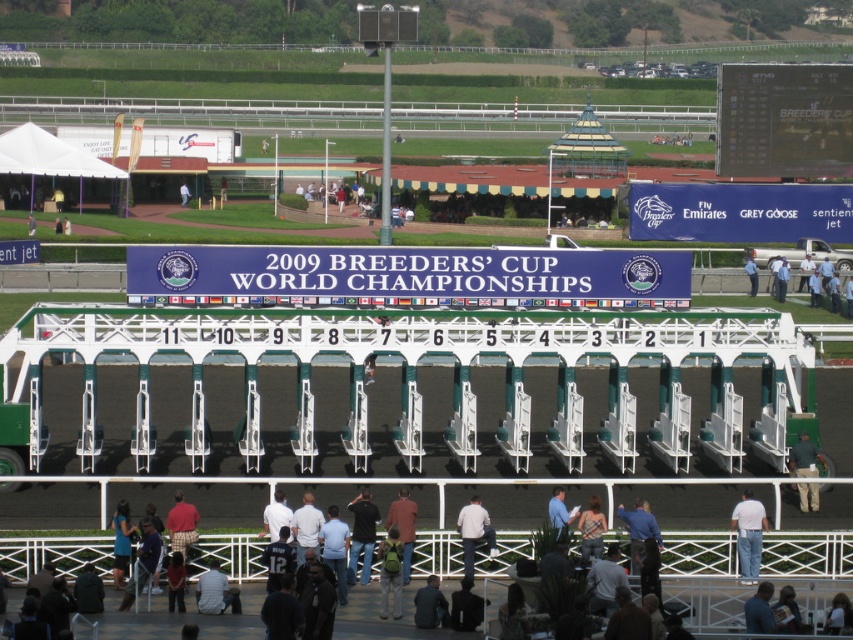
Can you confirm if white cotton shirt at lower right is smaller than camouflage fabric shirt at lower center?

Incorrect, white cotton shirt at lower right is not smaller in size than camouflage fabric shirt at lower center.

Is point (746, 534) positioned behind point (596, 548)?

Yes, point (746, 534) is behind point (596, 548).

Based on the photo, who is more forward, [759,547] or [596,552]?

Point [596,552]

The width and height of the screenshot is (853, 640). Identify the location of white cotton shirt at lower right. (747, 534).

Does green fabric jacket at lower right have a greater width compared to dark gray jacket at lower center?

Correct, the width of green fabric jacket at lower right exceeds that of dark gray jacket at lower center.

Is green fabric jacket at lower right shorter than dark gray jacket at lower center?

Yes, green fabric jacket at lower right is shorter than dark gray jacket at lower center.

Is point (811, 474) in front of point (445, 602)?

No, (811, 474) is behind (445, 602).

The height and width of the screenshot is (640, 853). In order to click on green fabric jacket at lower right in this screenshot , I will do coord(804,458).

Does green backpack at center appear on the left side of orange shirt at center?

Yes, green backpack at center is to the left of orange shirt at center.

Is point (386, 600) farther from viewer compared to point (407, 561)?

No, (386, 600) is in front of (407, 561).

This screenshot has height=640, width=853. Find the location of `green backpack at center`. green backpack at center is located at coordinates (390, 572).